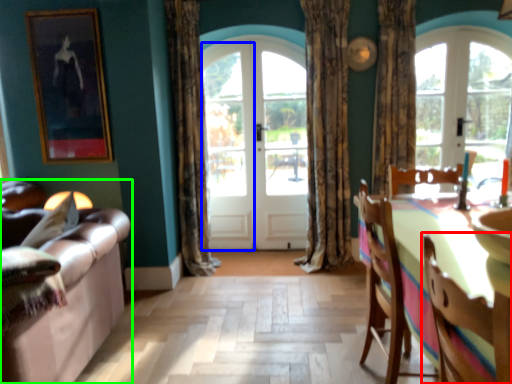
Question: Based on their relative distances, which object is nearer to chair (highlighted by a red box)? Choose from screen door (highlighted by a blue box) and studio couch (highlighted by a green box).

Choices:
 (A) screen door
 (B) studio couch

Answer: (B)